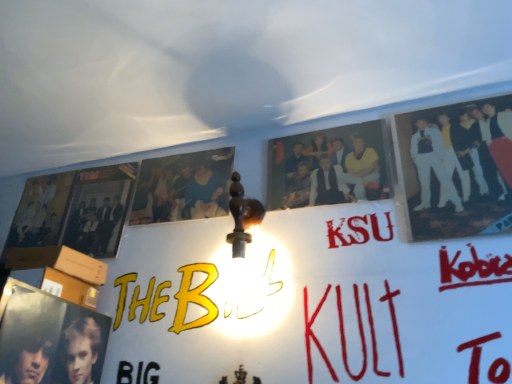
Question: In the image, is blue cotton shirt at upper center, arranged as the 1th person when viewed from the left, positioned in front of or behind white glossy suit at upper right, the 3th person when ordered from left to right?

Choices:
 (A) front
 (B) behind

Answer: (B)

Question: Is blue cotton shirt at upper center, which is the 3th person from right to left, situated inside white glossy suit at upper right, acting as the 1th person starting from the right, or outside?

Choices:
 (A) inside
 (B) outside

Answer: (B)

Question: Which object is positioned closest to the white glossy suit at upper right, acting as the 1th person starting from the right?

Choices:
 (A) matte black photo at center, marked as the second person in a right-to-left arrangement
 (B) blue cotton shirt at upper center, which is the 3th person from right to left
 (C) matte black poster at left

Answer: (A)

Question: Which object is positioned farthest from the blue cotton shirt at upper center, which is the 3th person from right to left?

Choices:
 (A) white glossy suit at upper right, the 3th person when ordered from left to right
 (B) matte black photo at center, which is the 2th person in left-to-right order
 (C) matte black poster at left

Answer: (A)